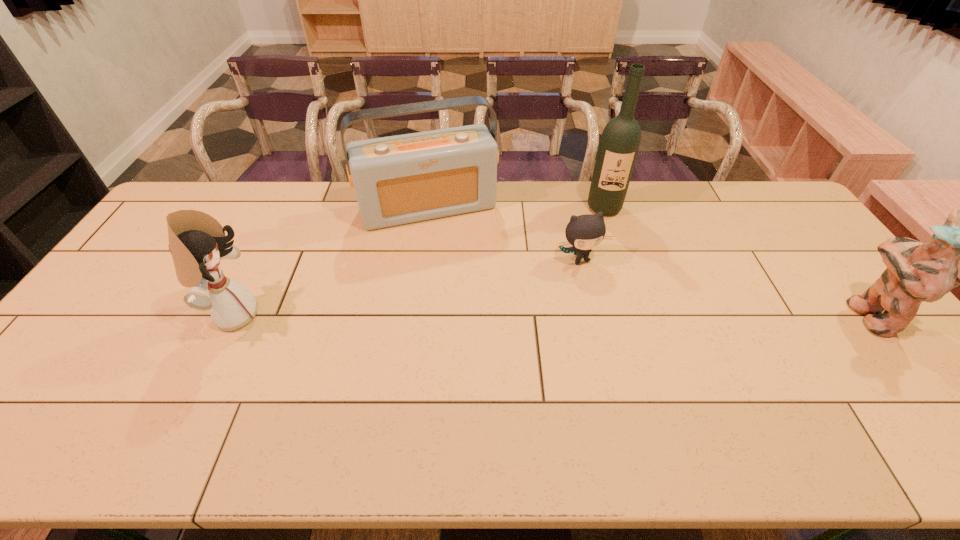
Find the location of a particular element. The width and height of the screenshot is (960, 540). vacant area that lies between the rightmost object and the second object from left to right is located at coordinates (649, 261).

Image resolution: width=960 pixels, height=540 pixels. Find the location of `vacant space that is in between the leftmost object and the kitten`. vacant space that is in between the leftmost object and the kitten is located at coordinates (406, 287).

Find the location of a particular element. The height and width of the screenshot is (540, 960). free area in between the rightmost object and the tallest object is located at coordinates (736, 261).

Locate an element on the screen. The image size is (960, 540). vacant point located between the fourth object from right to left and the kitten is located at coordinates (505, 233).

At what (x,y) coordinates should I click in order to perform the action: click on free space between the wine bottle and the leftmost object. Please return your answer as a coordinate pair (x, y). Looking at the image, I should click on (419, 261).

The height and width of the screenshot is (540, 960). I want to click on vacant space that is in between the radio receiver and the leftmost object, so click(x=331, y=261).

At what (x,y) coordinates should I click in order to perform the action: click on blank region between the shortest object and the radio receiver. Please return your answer as a coordinate pair (x, y). Looking at the image, I should click on (505, 233).

This screenshot has width=960, height=540. What are the coordinates of `object that ranks as the second closest to the leftmost object` in the screenshot? It's located at [584, 232].

The height and width of the screenshot is (540, 960). I want to click on object identified as the second closest to the leftmost object, so click(x=584, y=232).

Where is `blank space that satisfies the following two spatial constraints: 1. on the front side of the figurine; 2. on the front-facing side of the third farthest object`? blank space that satisfies the following two spatial constraints: 1. on the front side of the figurine; 2. on the front-facing side of the third farthest object is located at coordinates (593, 314).